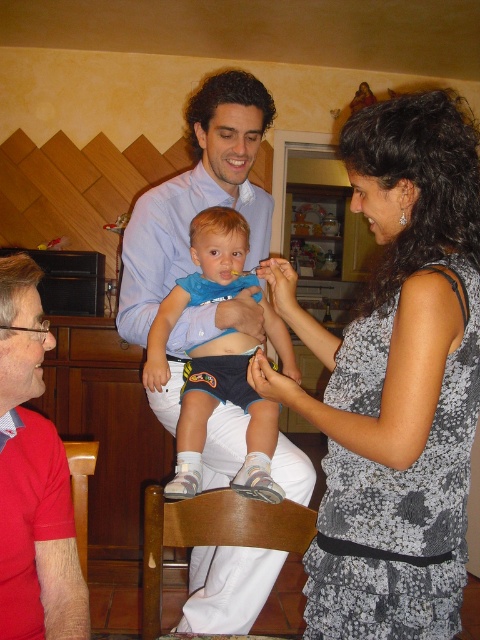
Does matte blue shorts at center have a greater height compared to wooden chair at lower left?

Indeed, matte blue shorts at center has a greater height compared to wooden chair at lower left.

Does matte blue shorts at center appear on the right side of wooden chair at lower left?

Correct, you'll find matte blue shorts at center to the right of wooden chair at lower left.

Between point (244, 244) and point (90, 470), which one is positioned behind?

The point (244, 244) is behind.

The height and width of the screenshot is (640, 480). In order to click on matte blue shorts at center in this screenshot , I will do `click(212, 412)`.

Who is shorter, floral dress at center or wooden chair at lower left?

wooden chair at lower left is shorter.

Is point (308, 604) positioned behind point (88, 442)?

No, (308, 604) is closer to viewer.

Locate an element on the screen. The height and width of the screenshot is (640, 480). floral dress at center is located at coordinates (396, 381).

Which of these two, red cotton shirt at left or wooden chair at lower center, stands taller?

red cotton shirt at left is taller.

Is red cotton shirt at left smaller than wooden chair at lower center?

No.

Which is behind, point (32, 529) or point (249, 504)?

The point (249, 504) is behind.

I want to click on red cotton shirt at left, so click(x=33, y=480).